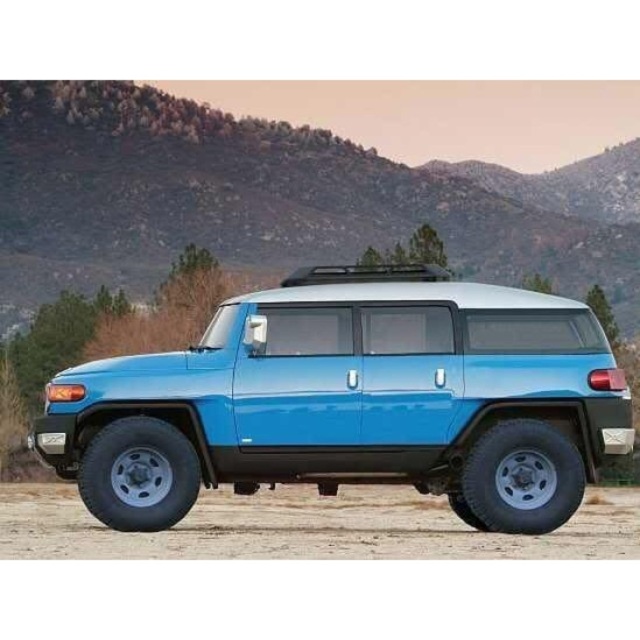
You are standing in front of the bright blue Toyota FJ Cruiser parked outdoors. You see two points marked on the car, one at point coordinates (352, 307) and the other at point coordinates (397, 531). Which point is nearer to you?

Point (352, 307) is closer to the viewer than point (397, 531).

You are a photographer planning to take a wide shot of the matte blue suv at center and the dirt field at lower center. Which object should you focus on first if you want to capture both in a single frame without moving the camera?

The matte blue suv at center is larger in size than the dirt field at lower center, so focusing on the matte blue suv at center first would ensure it takes up more of the frame while still including the dirt field at lower center in the background.